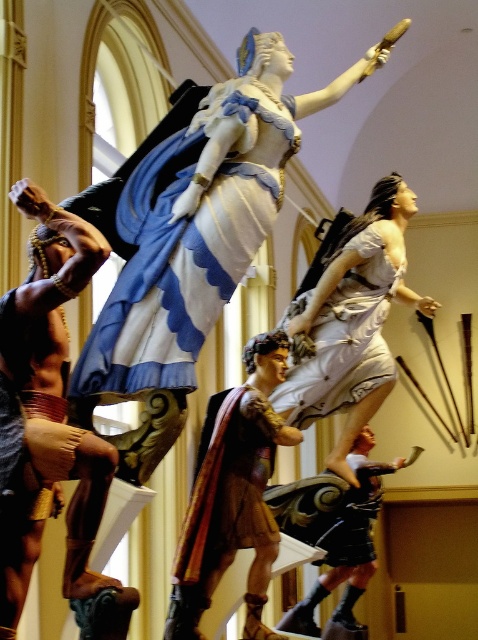
You are an art curator planning to install a new spotlight above the white fabric dress at center. Considering the polished bronze warrior at center is directly below it, will the spotlight cast a shadow of the dress onto the warrior?

The white fabric dress at center is located above the polished bronze warrior at center, so the spotlight placed above the dress will cast a shadow of the dress onto the warrior.